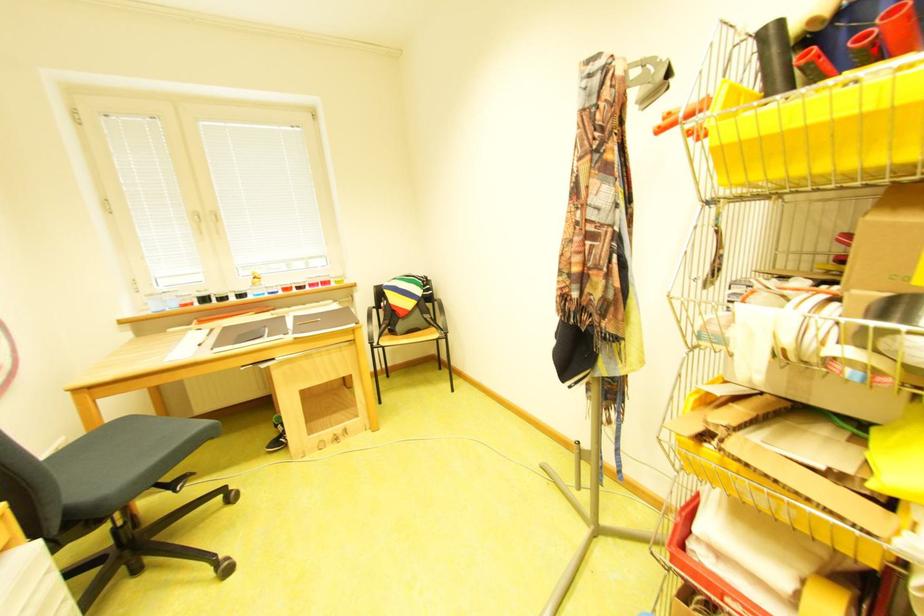
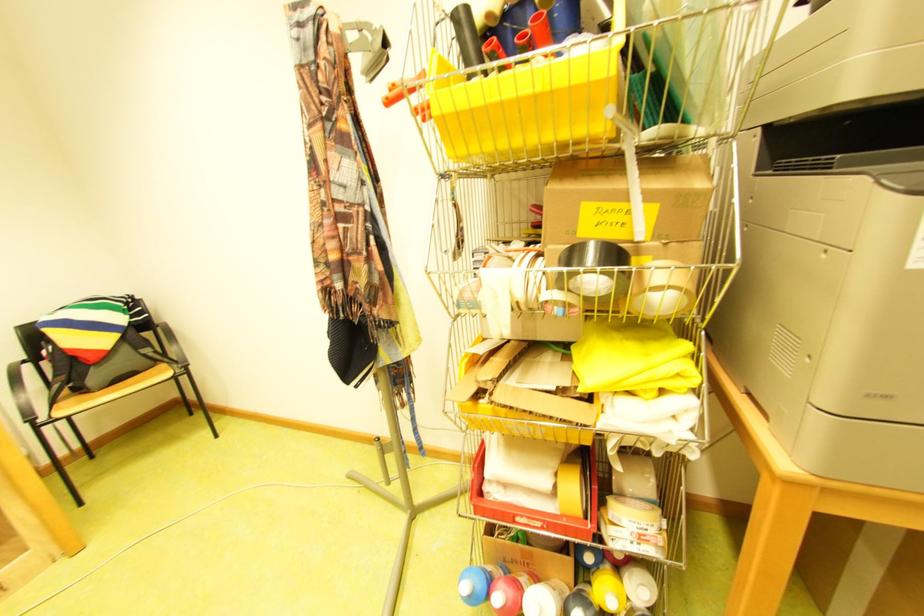
Where in the second image is the point corresponding to the highlighted location from the first image?

(531, 51)